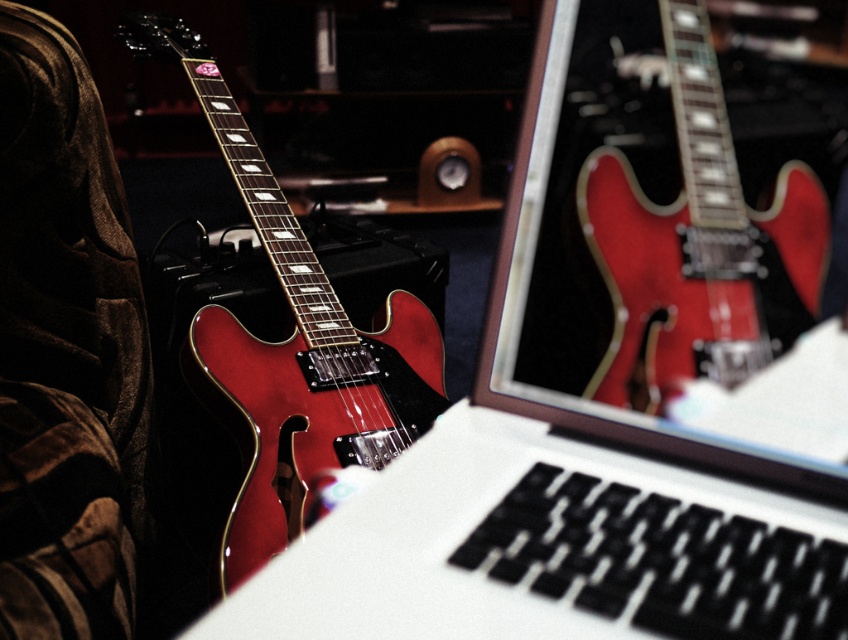
Can you confirm if glossy red electric guitar at center is positioned to the right of glossy red guitar at left?

Correct, you'll find glossy red electric guitar at center to the right of glossy red guitar at left.

Measure the distance between glossy red electric guitar at center and glossy red guitar at left.

A distance of 32.44 inches exists between glossy red electric guitar at center and glossy red guitar at left.

Image resolution: width=848 pixels, height=640 pixels. What do you see at coordinates (696, 244) in the screenshot?
I see `glossy red electric guitar at center` at bounding box center [696, 244].

The image size is (848, 640). In order to click on glossy red electric guitar at center in this screenshot , I will do `click(696, 244)`.